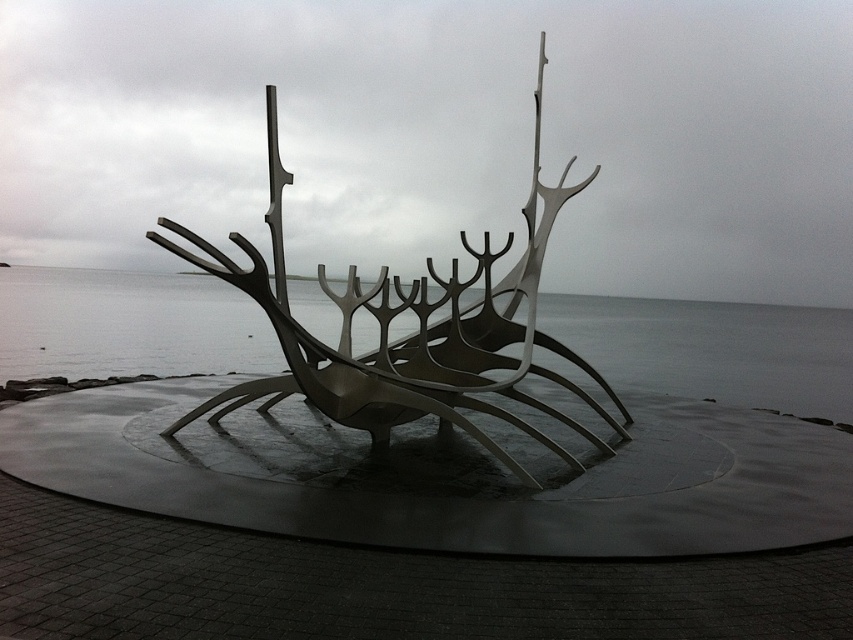
Question: Which point is farther to the camera?

Choices:
 (A) (86, 326)
 (B) (283, 275)

Answer: (A)

Question: Does gray metallic water at center have a larger size compared to metallic silver ship at center?

Choices:
 (A) yes
 (B) no

Answer: (A)

Question: Which point is farther from the camera taking this photo?

Choices:
 (A) (813, 317)
 (B) (413, 371)

Answer: (A)

Question: In this image, where is gray metallic water at center located relative to metallic silver ship at center?

Choices:
 (A) left
 (B) right

Answer: (A)

Question: Which of the following is the closest to the observer?

Choices:
 (A) (270, 122)
 (B) (83, 337)

Answer: (A)

Question: Considering the relative positions of gray metallic water at center and metallic silver ship at center in the image provided, where is gray metallic water at center located with respect to metallic silver ship at center?

Choices:
 (A) above
 (B) below

Answer: (B)